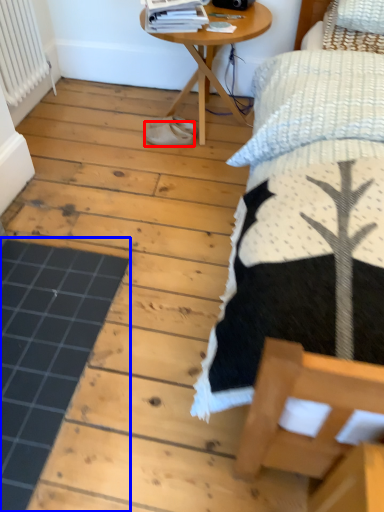
Question: Which point is closer to the camera, footwear (highlighted by a red box) or plank (highlighted by a blue box)?

Choices:
 (A) footwear
 (B) plank

Answer: (B)